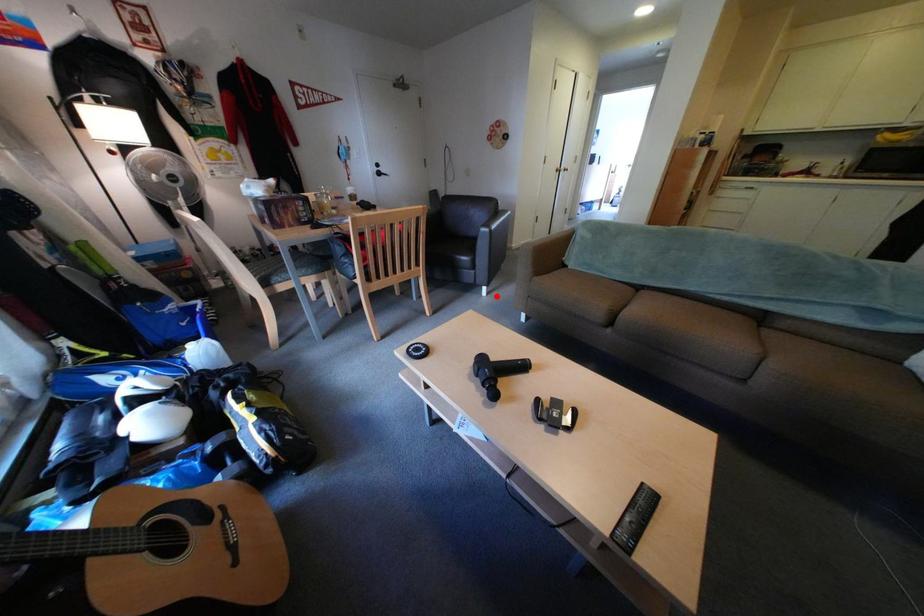
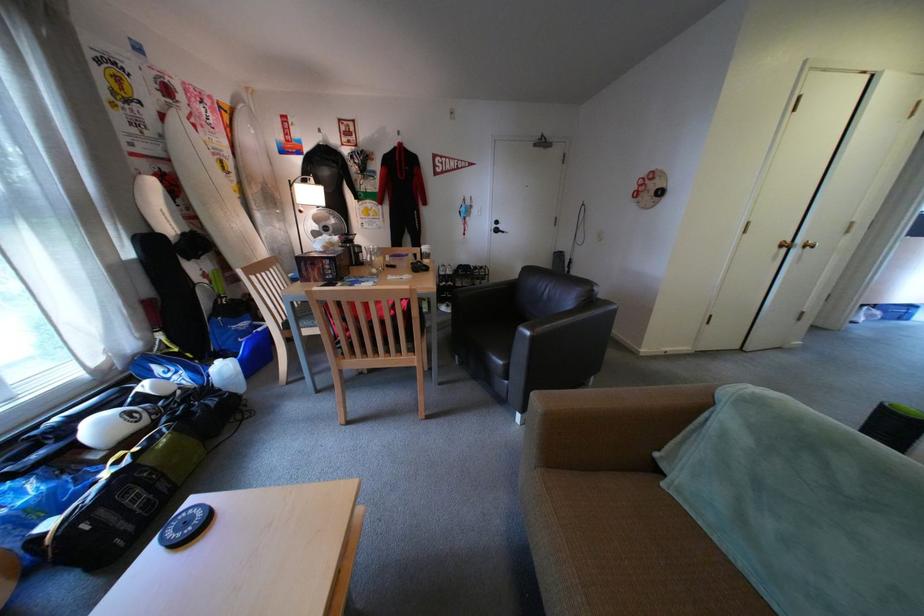
The point at the highlighted location is marked in the first image. Where is the corresponding point in the second image?

(530, 422)